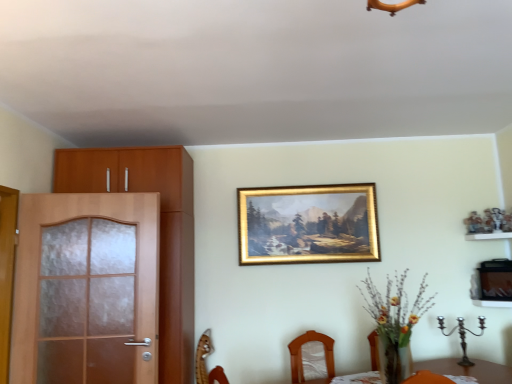
Question: Visually, is matte wood cabinet at left positioned to the left or to the right of wooden chair at lower center?

Choices:
 (A) right
 (B) left

Answer: (B)

Question: Is matte wood cabinet at left inside the boundaries of wooden chair at lower center, or outside?

Choices:
 (A) outside
 (B) inside

Answer: (A)

Question: Which object is positioned farthest from the matte wood cabinet at left?

Choices:
 (A) wooden chair at lower center
 (B) gold/gilded picture frame at upper center
 (C) brown matte screen door at left
 (D) wooden shelf at right

Answer: (D)

Question: Which object is the farthest from the brown matte screen door at left?

Choices:
 (A) wooden shelf at right
 (B) matte wood cabinet at left
 (C) gold/gilded picture frame at upper center
 (D) wooden chair at lower center

Answer: (A)